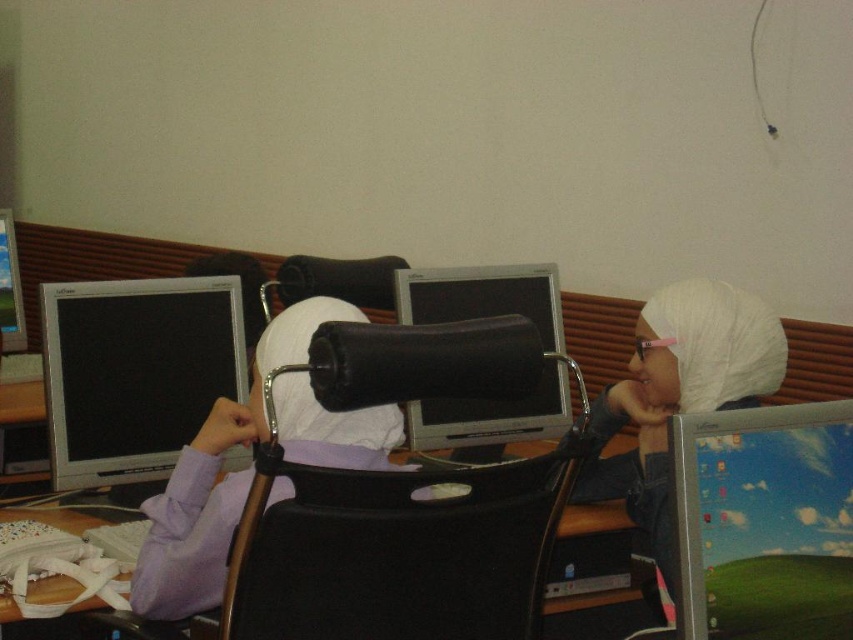
You are standing in the classroom looking at the three computer monitors. There are two points marked on the rightmost monitor. Which of the two points, point 1 at coordinates [831,474] or point 2 at coordinates [97,472], is closer to you on the monitor?

Point 1 at coordinates [831,474] is closer to the viewer than point 2 at coordinates [97,472] on the monitor.

You are a student who needs to adjust the height of your monitor. You have access to both the silver glossy monitor at lower right and the matte black monitor at left. Which monitor should you choose if you want one that requires less adjustment to reach your preferred viewing height?

The silver glossy monitor at lower right has a lesser height compared to the matte black monitor at left, so you should choose the silver glossy monitor at lower right since it is shorter and may require less adjustment to reach your preferred viewing height.